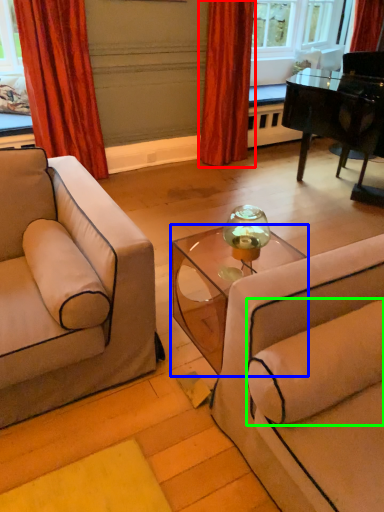
Question: Estimate the real-world distances between objects in this image. Which object is farther from curtain (highlighted by a red box), table (highlighted by a blue box) or pillow (highlighted by a green box)?

Choices:
 (A) table
 (B) pillow

Answer: (B)